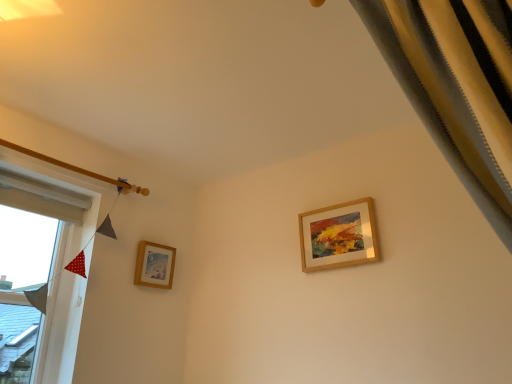
Question: Is white fabric at left positioned far away from wooden picture frame at upper right, the 1th picture frame in the right-to-left sequence?

Choices:
 (A) yes
 (B) no

Answer: (A)

Question: Considering the relative sizes of white fabric at left and wooden picture frame at upper right, acting as the 2th picture frame starting from the left, in the image provided, is white fabric at left wider than wooden picture frame at upper right, acting as the 2th picture frame starting from the left,?

Choices:
 (A) yes
 (B) no

Answer: (A)

Question: Can you confirm if white fabric at left is shorter than wooden picture frame at upper right, the 1th picture frame in the right-to-left sequence?

Choices:
 (A) no
 (B) yes

Answer: (A)

Question: Is white fabric at left at the right side of wooden picture frame at upper right, which is counted as the 1th picture frame, starting from the front?

Choices:
 (A) yes
 (B) no

Answer: (B)

Question: Is white fabric at left oriented towards wooden picture frame at upper right, which is counted as the 2th picture frame, starting from the back?

Choices:
 (A) no
 (B) yes

Answer: (A)

Question: Is wooden picture frame at lower left, the second picture frame positioned from the front, taller or shorter than silky yellow curtain at upper right?

Choices:
 (A) short
 (B) tall

Answer: (A)

Question: Considering the positions of wooden picture frame at lower left, placed as the second picture frame when sorted from right to left, and silky yellow curtain at upper right in the image, is wooden picture frame at lower left, placed as the second picture frame when sorted from right to left, bigger or smaller than silky yellow curtain at upper right?

Choices:
 (A) big
 (B) small

Answer: (B)

Question: Is wooden picture frame at lower left, the second picture frame positioned from the front, wider or thinner than silky yellow curtain at upper right?

Choices:
 (A) thin
 (B) wide

Answer: (A)

Question: Would you say wooden picture frame at lower left, the second picture frame positioned from the front, is to the left or to the right of silky yellow curtain at upper right in the picture?

Choices:
 (A) right
 (B) left

Answer: (B)

Question: Does point (364, 251) appear closer or farther from the camera than point (10, 196)?

Choices:
 (A) farther
 (B) closer

Answer: (B)

Question: Is wooden picture frame at upper right, which is counted as the 1th picture frame, starting from the front, inside the boundaries of white fabric at left, or outside?

Choices:
 (A) outside
 (B) inside

Answer: (A)

Question: Would you say wooden picture frame at upper right, acting as the 2th picture frame starting from the left, is to the left or to the right of white fabric at left in the picture?

Choices:
 (A) left
 (B) right

Answer: (B)

Question: Is wooden picture frame at upper right, which is counted as the 1th picture frame, starting from the front, bigger or smaller than white fabric at left?

Choices:
 (A) big
 (B) small

Answer: (B)

Question: Considering the positions of white fabric at left and wooden picture frame at lower left, placed as the second picture frame when sorted from right to left, in the image, is white fabric at left taller or shorter than wooden picture frame at lower left, placed as the second picture frame when sorted from right to left,?

Choices:
 (A) tall
 (B) short

Answer: (A)

Question: Considering the relative positions of white fabric at left and wooden picture frame at lower left, placed as the second picture frame when sorted from right to left, in the image provided, is white fabric at left to the left or to the right of wooden picture frame at lower left, placed as the second picture frame when sorted from right to left,?

Choices:
 (A) left
 (B) right

Answer: (A)